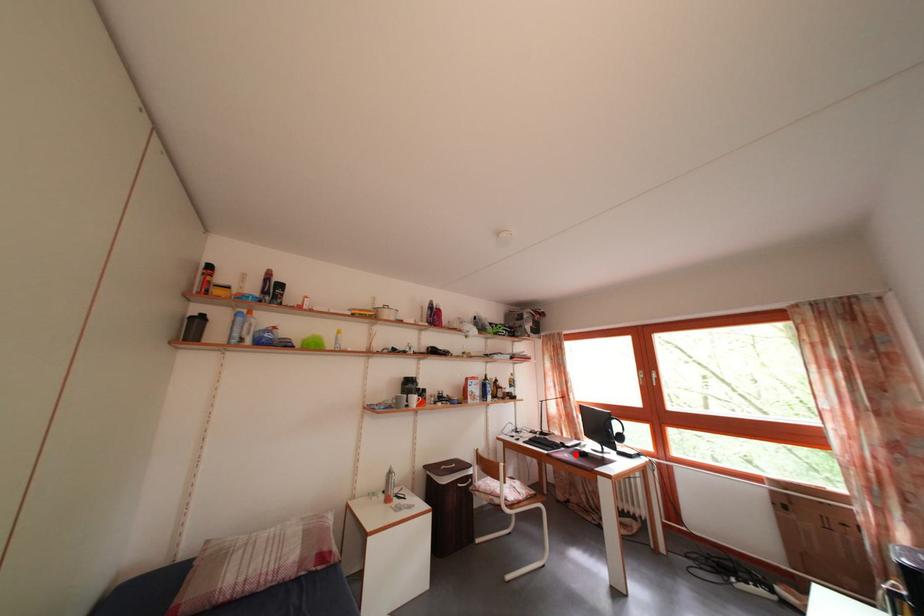
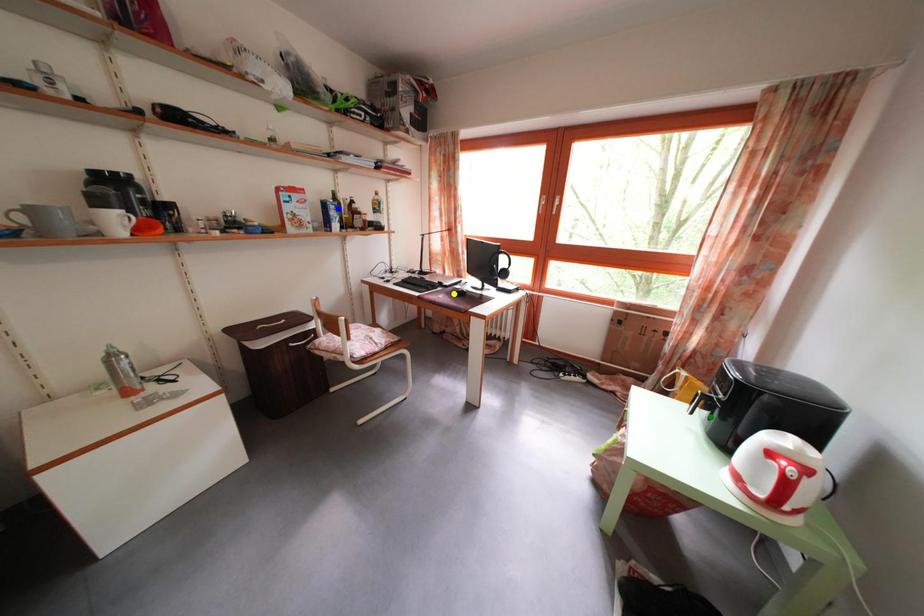
Question: I am providing you with two images of the same scene from different viewpoints. A red point is marked on the first image. You are given multiple points on the second image. Which point in image 2 represents the same 3d spot as the red point in image 1?

Choices:
 (A) green point
 (B) blue point
 (C) yellow point

Answer: (C)